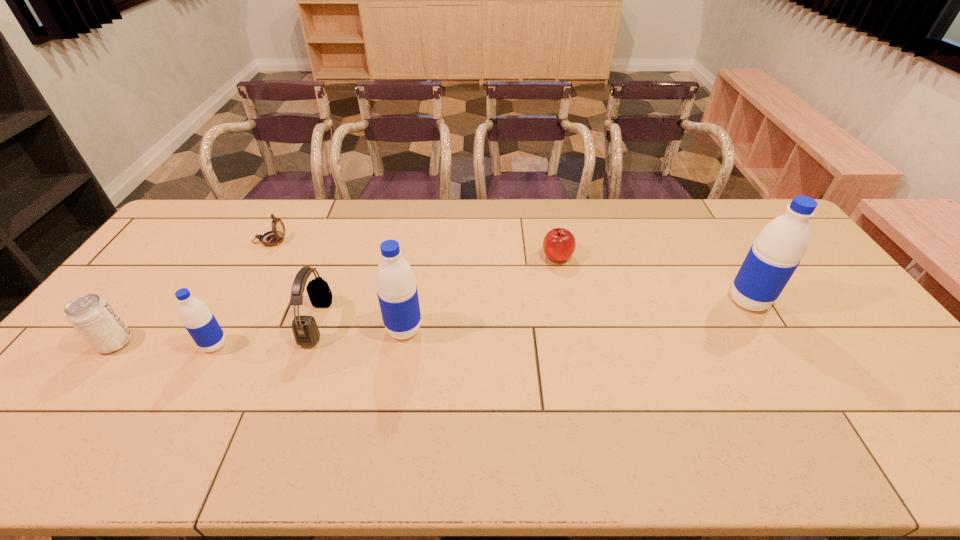
Locate an element on the screen. Image resolution: width=960 pixels, height=540 pixels. vacant space located 0.230m on the left of the second water bottle from left to right is located at coordinates (303, 329).

The width and height of the screenshot is (960, 540). Identify the location of vacant region located 0.180m on the left of the rightmost water bottle. (667, 301).

Image resolution: width=960 pixels, height=540 pixels. I want to click on vacant space situated on the face of the compass, so click(310, 240).

Where is `free point located 0.080m on the headband of the fourth object from right to left`? The height and width of the screenshot is (540, 960). free point located 0.080m on the headband of the fourth object from right to left is located at coordinates (355, 321).

Identify the location of free region located 0.080m on the front of the apple. (563, 285).

You are a GUI agent. You are given a task and a screenshot of the screen. Output one action in this format:
    pyautogui.click(x=<x>, y=<y>)
    Task: Click on the free space located 0.180m on the front of the leftmost object
    
    Given the screenshot: What is the action you would take?
    pyautogui.click(x=58, y=418)

I want to click on object at the far edge, so click(271, 238).

You are a GUI agent. You are given a task and a screenshot of the screen. Output one action in this format:
    pyautogui.click(x=<x>, y=<y>)
    Task: Click on the object situated at the left edge
    
    Given the screenshot: What is the action you would take?
    pyautogui.click(x=92, y=316)

The width and height of the screenshot is (960, 540). In the image, there is a desktop. Identify the location of blank space at the far edge. (531, 201).

In the image, there is a desktop. In order to click on blank space at the near edge in this screenshot , I will do `click(694, 415)`.